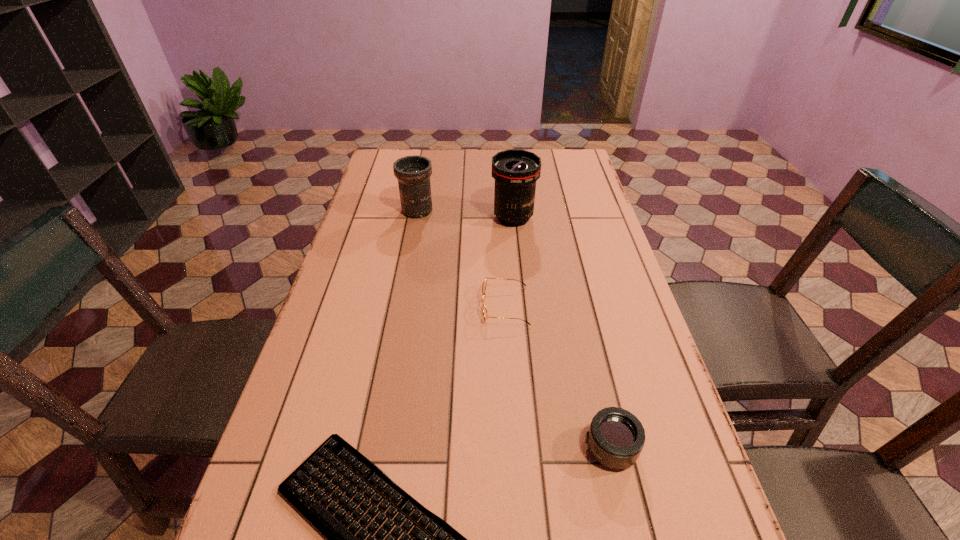
Locate which object ranks fourth in proximity to the nearest telephoto lens. Please provide its 2D coordinates. Your answer should be formatted as a tuple, i.e. [(x, y)], where the tuple contains the x and y coordinates of a point satisfying the conditions above.

[(413, 173)]

Identify which telephoto lens is located as the nearest to the shortest telephoto lens. Please provide its 2D coordinates. Your answer should be formatted as a tuple, i.e. [(x, y)], where the tuple contains the x and y coordinates of a point satisfying the conditions above.

[(515, 171)]

Point out which telephoto lens is positioned as the nearest to the tallest telephoto lens. Please provide its 2D coordinates. Your answer should be formatted as a tuple, i.e. [(x, y)], where the tuple contains the x and y coordinates of a point satisfying the conditions above.

[(413, 173)]